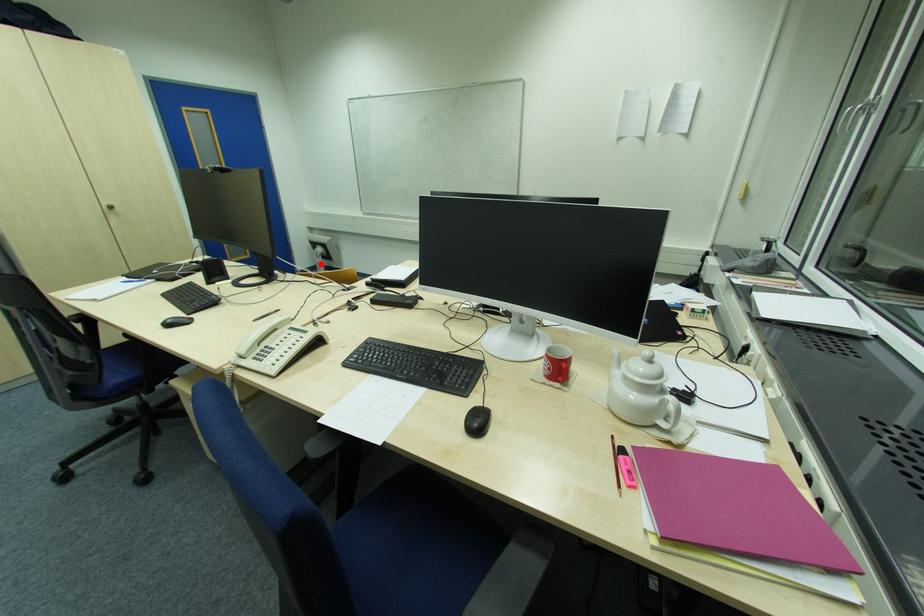
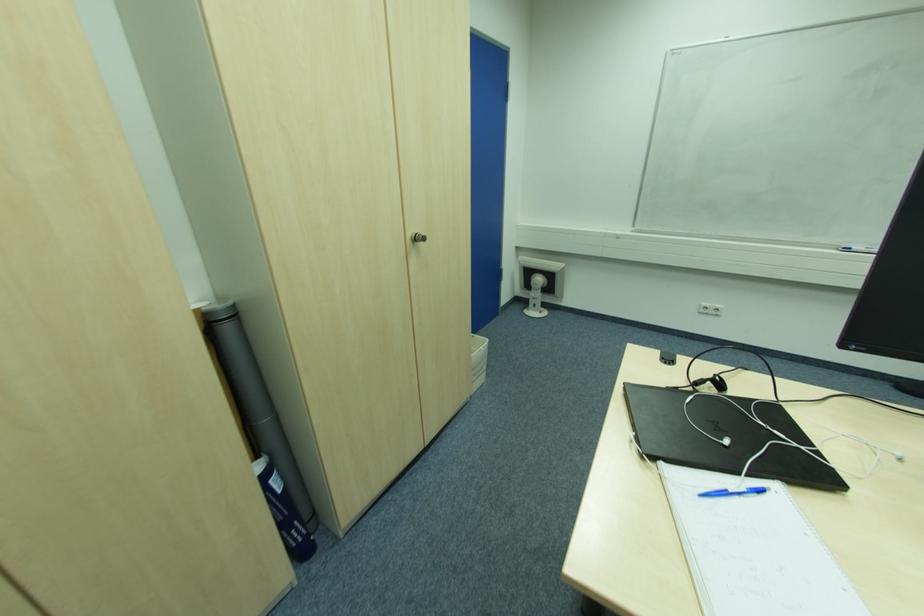
Find the pixel in the second image that matches the highlighted location in the first image.

(536, 300)